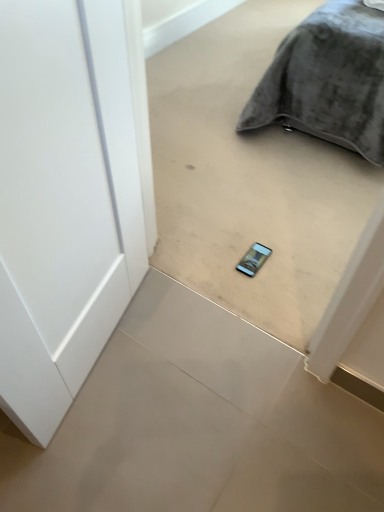
What do you see at coordinates (198, 423) in the screenshot? This screenshot has width=384, height=512. I see `white glossy concrete at center, the second concrete positioned from the top` at bounding box center [198, 423].

At what (x,y) coordinates should I click in order to perform the action: click on white glossy concrete at center, placed as the first concrete when sorted from bottom to top. Please return your answer as a coordinate pair (x, y). Looking at the image, I should click on (198, 423).

I want to click on matte gray phone at center, acting as the second concrete starting from the bottom, so click(249, 179).

Is white glossy concrete at center, the second concrete positioned from the top, shorter than velvet gray pillow at upper right?

Indeed, white glossy concrete at center, the second concrete positioned from the top, has a lesser height compared to velvet gray pillow at upper right.

From the image's perspective, which one is positioned lower, white glossy concrete at center, placed as the first concrete when sorted from bottom to top, or velvet gray pillow at upper right?

white glossy concrete at center, placed as the first concrete when sorted from bottom to top, appears lower in the image.

Which is behind, point (11, 460) or point (378, 15)?

Point (378, 15)

Considering the sizes of objects white glossy concrete at center, the second concrete positioned from the top, and velvet gray pillow at upper right in the image provided, who is thinner, white glossy concrete at center, the second concrete positioned from the top, or velvet gray pillow at upper right?

Thinner between the two is velvet gray pillow at upper right.

Is point (62, 474) in front of point (273, 154)?

Yes.

Is white glossy concrete at center, the second concrete positioned from the top, facing towards matte gray phone at center, acting as the second concrete starting from the bottom?

No.

Is white glossy concrete at center, the second concrete positioned from the top, at the right side of matte gray phone at center, which is counted as the first concrete, starting from the top?

No, white glossy concrete at center, the second concrete positioned from the top, is not to the right of matte gray phone at center, which is counted as the first concrete, starting from the top.

Can you tell me how much white glossy concrete at center, the second concrete positioned from the top, and matte gray phone at center, acting as the second concrete starting from the bottom, differ in facing direction?

The angular difference between white glossy concrete at center, the second concrete positioned from the top, and matte gray phone at center, acting as the second concrete starting from the bottom, is 180 degrees.

From the image's perspective, who appears lower, velvet gray pillow at upper right or white glossy concrete at center, placed as the first concrete when sorted from bottom to top?

white glossy concrete at center, placed as the first concrete when sorted from bottom to top, from the image's perspective.

Between velvet gray pillow at upper right and white glossy concrete at center, the second concrete positioned from the top, which one has less height?

With less height is white glossy concrete at center, the second concrete positioned from the top.

Considering the relative sizes of velvet gray pillow at upper right and white glossy concrete at center, the second concrete positioned from the top, in the image provided, is velvet gray pillow at upper right wider than white glossy concrete at center, the second concrete positioned from the top,?

In fact, velvet gray pillow at upper right might be narrower than white glossy concrete at center, the second concrete positioned from the top.

Is velvet gray pillow at upper right in front of or behind white glossy concrete at center, placed as the first concrete when sorted from bottom to top, in the image?

In the image, velvet gray pillow at upper right appears behind white glossy concrete at center, placed as the first concrete when sorted from bottom to top.

Between matte gray phone at center, acting as the second concrete starting from the bottom, and white glossy concrete at center, the second concrete positioned from the top, which one has less height?

white glossy concrete at center, the second concrete positioned from the top.

Identify the location of concrete on the right side of white glossy concrete at center, the second concrete positioned from the top. (249, 179).

Does point (179, 90) come in front of point (289, 387)?

No, it is behind (289, 387).

Looking at this image, is matte gray phone at center, acting as the second concrete starting from the bottom, completely or partially outside of white glossy concrete at center, the second concrete positioned from the top?

Absolutely, matte gray phone at center, acting as the second concrete starting from the bottom, is external to white glossy concrete at center, the second concrete positioned from the top.

Looking at this image, is velvet gray pillow at upper right bigger than matte gray phone at center, acting as the second concrete starting from the bottom?

Yes.

Are velvet gray pillow at upper right and matte gray phone at center, which is counted as the first concrete, starting from the top, making contact?

There is a gap between velvet gray pillow at upper right and matte gray phone at center, which is counted as the first concrete, starting from the top.

From the image's perspective, would you say velvet gray pillow at upper right is shown under matte gray phone at center, acting as the second concrete starting from the bottom?

No, from the image's perspective, velvet gray pillow at upper right is not below matte gray phone at center, acting as the second concrete starting from the bottom.

Can you confirm if matte gray phone at center, acting as the second concrete starting from the bottom, is bigger than velvet gray pillow at upper right?

No, matte gray phone at center, acting as the second concrete starting from the bottom, is not bigger than velvet gray pillow at upper right.

Which is more to the left, matte gray phone at center, acting as the second concrete starting from the bottom, or velvet gray pillow at upper right?

From the viewer's perspective, matte gray phone at center, acting as the second concrete starting from the bottom, appears more on the left side.

Based on the photo, can you confirm if matte gray phone at center, acting as the second concrete starting from the bottom, is thinner than velvet gray pillow at upper right?

Correct, the width of matte gray phone at center, acting as the second concrete starting from the bottom, is less than that of velvet gray pillow at upper right.

Is matte gray phone at center, acting as the second concrete starting from the bottom, spatially inside velvet gray pillow at upper right, or outside of it?

matte gray phone at center, acting as the second concrete starting from the bottom, exists outside the volume of velvet gray pillow at upper right.

Starting from the velvet gray pillow at upper right, which concrete is the 2nd one to the left? Please provide its 2D coordinates.

[(198, 423)]

Locate an element on the screen. The height and width of the screenshot is (512, 384). concrete on the right of white glossy concrete at center, the second concrete positioned from the top is located at coordinates (249, 179).

From the image, which object appears to be farther from white glossy concrete at center, placed as the first concrete when sorted from bottom to top, matte gray phone at center, which is counted as the first concrete, starting from the top, or velvet gray pillow at upper right?

The object further to white glossy concrete at center, placed as the first concrete when sorted from bottom to top, is velvet gray pillow at upper right.

Looking at the image, which one is located further to velvet gray pillow at upper right, matte gray phone at center, acting as the second concrete starting from the bottom, or white glossy concrete at center, the second concrete positioned from the top?

white glossy concrete at center, the second concrete positioned from the top, is further to velvet gray pillow at upper right.

Which object lies further to the anchor point velvet gray pillow at upper right, white glossy concrete at center, placed as the first concrete when sorted from bottom to top, or matte gray phone at center, acting as the second concrete starting from the bottom?

white glossy concrete at center, placed as the first concrete when sorted from bottom to top.

In the scene shown: Looking at the image, which one is located closer to matte gray phone at center, acting as the second concrete starting from the bottom, white glossy concrete at center, the second concrete positioned from the top, or velvet gray pillow at upper right?

Among the two, velvet gray pillow at upper right is located nearer to matte gray phone at center, acting as the second concrete starting from the bottom.

From the image, which object appears to be nearer to matte gray phone at center, acting as the second concrete starting from the bottom, velvet gray pillow at upper right or white glossy concrete at center, the second concrete positioned from the top?

velvet gray pillow at upper right is positioned closer to the anchor matte gray phone at center, acting as the second concrete starting from the bottom.

Estimate the real-world distances between objects in this image. Which object is closer to white glossy concrete at center, the second concrete positioned from the top, velvet gray pillow at upper right or matte gray phone at center, acting as the second concrete starting from the bottom?

matte gray phone at center, acting as the second concrete starting from the bottom, is closer to white glossy concrete at center, the second concrete positioned from the top.

You are a GUI agent. You are given a task and a screenshot of the screen. Output one action in this format:
    pyautogui.click(x=<x>, y=<y>)
    Task: Click on the concrete between velvet gray pillow at upper right and white glossy concrete at center, placed as the first concrete when sorted from bottom to top, in the up-down direction
    The width and height of the screenshot is (384, 512).
    Given the screenshot: What is the action you would take?
    pyautogui.click(x=249, y=179)